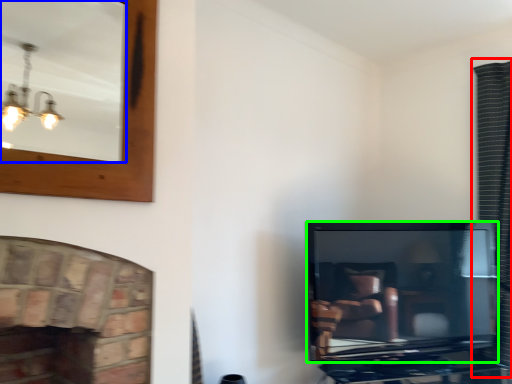
Question: Based on their relative distances, which object is nearer to curtain (highlighted by a red box)? Choose from mirror (highlighted by a blue box) and television (highlighted by a green box).

Choices:
 (A) mirror
 (B) television

Answer: (B)